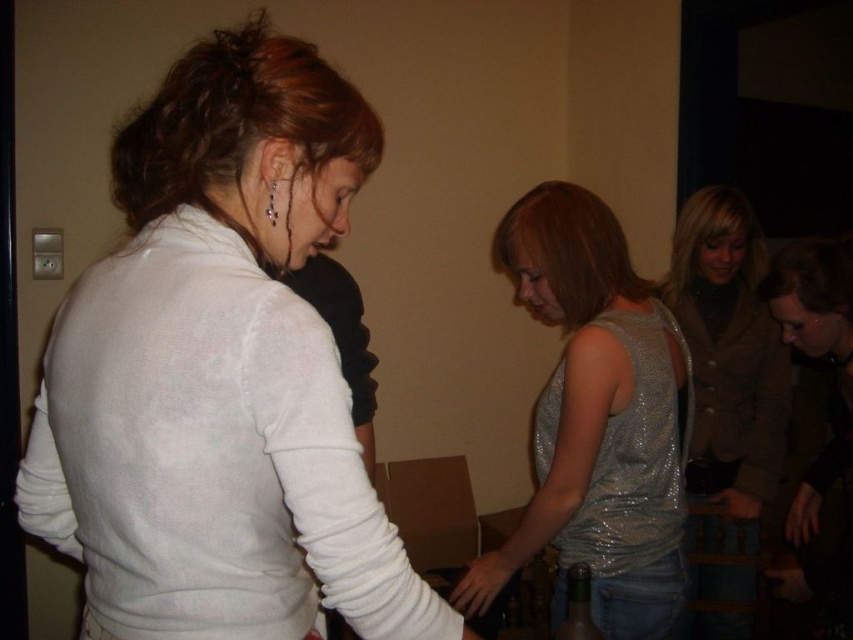
Does white matte sweater at upper left appear under sparkly silver dress at center?

No.

Where is `white matte sweater at upper left`? This screenshot has height=640, width=853. white matte sweater at upper left is located at coordinates (219, 372).

Locate an element on the screen. This screenshot has width=853, height=640. white matte sweater at upper left is located at coordinates (219, 372).

How far apart are sparkly silver tank top at center and sparkly silver dress at center?

sparkly silver tank top at center and sparkly silver dress at center are 32.26 inches apart from each other.

This screenshot has height=640, width=853. What do you see at coordinates (601, 412) in the screenshot? I see `sparkly silver tank top at center` at bounding box center [601, 412].

Is point (538, 486) closer to viewer compared to point (679, 278)?

Yes, point (538, 486) is in front of point (679, 278).

The image size is (853, 640). Find the location of `sparkly silver tank top at center`. sparkly silver tank top at center is located at coordinates (601, 412).

Between sparkly silver tank top at center and smooth skin hand at center, which one has more height?

sparkly silver tank top at center

Who is more distant from viewer, [572,531] or [486,588]?

Positioned behind is point [486,588].

Describe the element at coordinates (601, 412) in the screenshot. I see `sparkly silver tank top at center` at that location.

Find the location of a particular element. This screenshot has height=640, width=853. sparkly silver tank top at center is located at coordinates (601, 412).